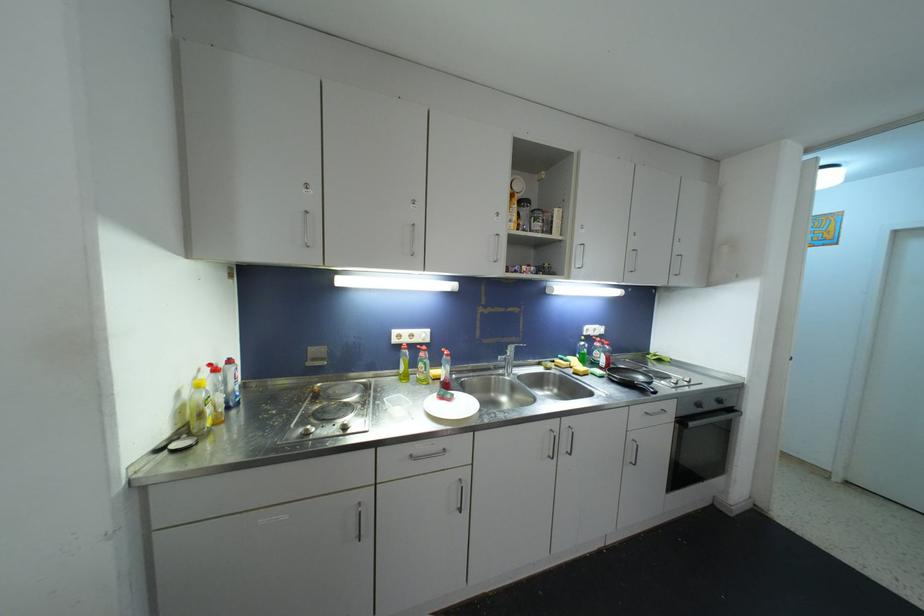
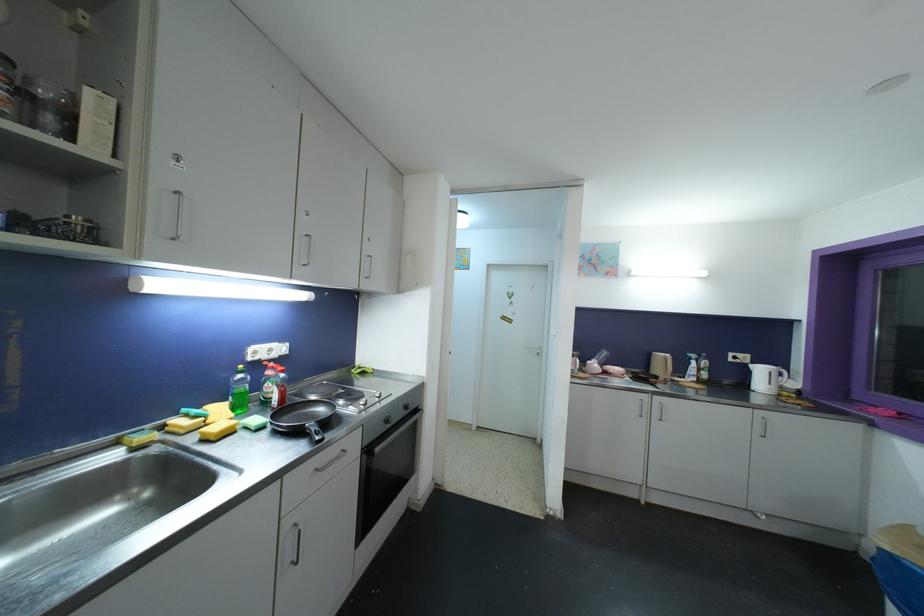
Question: I am providing you with two images of the same scene from different viewpoints. Please identify which objects are invisible in image2.

Choices:
 (A) white kettle
 (B) frying pan handle
 (C) cabinet door lock
 (D) none of these

Answer: (D)